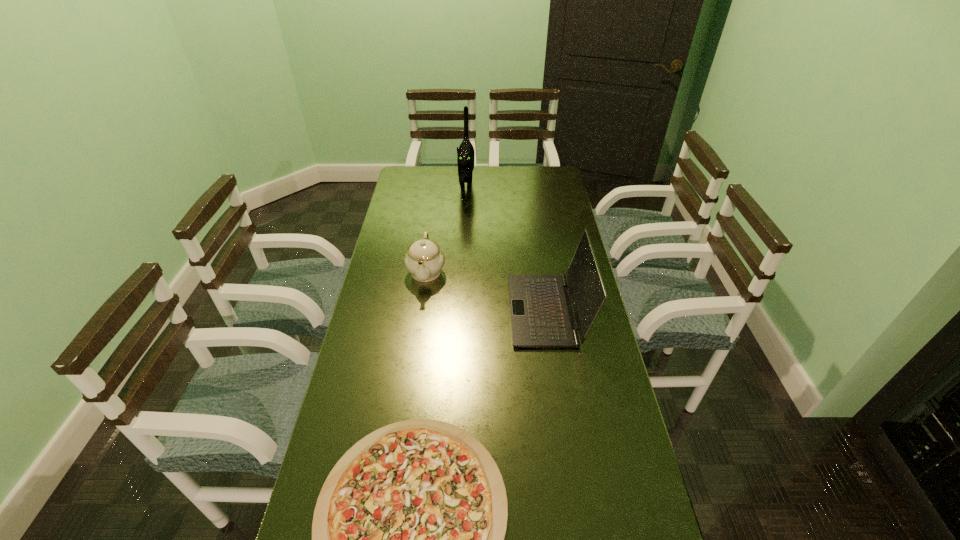
In order to click on object that is at the far edge in this screenshot , I will do `click(465, 153)`.

Find the location of a particular element. object located at the left edge is located at coordinates (424, 259).

In order to click on object that is at the right edge in this screenshot , I will do `click(542, 316)`.

I want to click on vacant space at the far edge of the desktop, so click(x=495, y=188).

Identify the location of free space at the left edge. Image resolution: width=960 pixels, height=540 pixels. (358, 430).

The image size is (960, 540). What are the coordinates of `free space at the right edge of the desktop` in the screenshot? It's located at (550, 204).

What are the coordinates of `free space at the far left corner of the desktop` in the screenshot? It's located at (428, 177).

The image size is (960, 540). In the image, there is a desktop. Identify the location of vacant space at the far right corner. (546, 174).

Where is `free space that is in between the third shortest object and the tallest object`? The image size is (960, 540). free space that is in between the third shortest object and the tallest object is located at coordinates 507,249.

What are the coordinates of `vacant region between the farthest object and the third shortest object` in the screenshot? It's located at (507, 249).